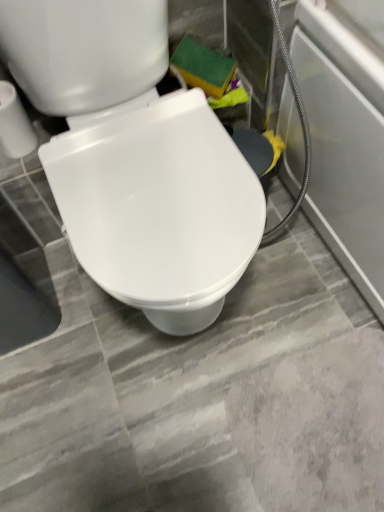
What do you see at coordinates (159, 208) in the screenshot? I see `white glossy toilet seat at center` at bounding box center [159, 208].

The height and width of the screenshot is (512, 384). I want to click on white glossy toilet seat at center, so click(x=159, y=208).

At what (x,y) coordinates should I click in order to perform the action: click on white glossy toilet seat at center. Please return your answer as a coordinate pair (x, y). The height and width of the screenshot is (512, 384). Looking at the image, I should click on (159, 208).